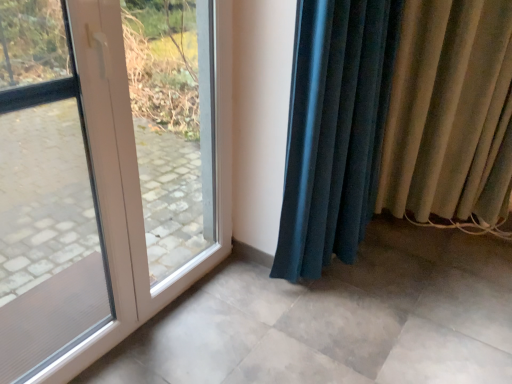
Question: Visually, is beige fabric curtain at right, arranged as the second curtain when viewed from the left, positioned to the left or to the right of velvet teal curtain at lower right, placed as the second curtain when sorted from right to left?

Choices:
 (A) left
 (B) right

Answer: (B)

Question: Considering their positions, is beige fabric curtain at right, positioned as the 1th curtain in right-to-left order, located in front of or behind velvet teal curtain at lower right, acting as the first curtain starting from the left?

Choices:
 (A) behind
 (B) front

Answer: (A)

Question: Which of these objects is positioned farthest from the white plastic door at left?

Choices:
 (A) beige fabric curtain at right, positioned as the 1th curtain in right-to-left order
 (B) velvet teal curtain at lower right, acting as the first curtain starting from the left

Answer: (B)

Question: Considering the real-world distances, which object is farthest from the velvet teal curtain at lower right, acting as the first curtain starting from the left?

Choices:
 (A) beige fabric curtain at right, positioned as the 1th curtain in right-to-left order
 (B) white plastic door at left

Answer: (B)